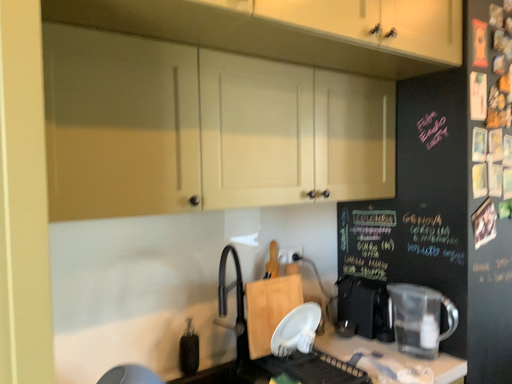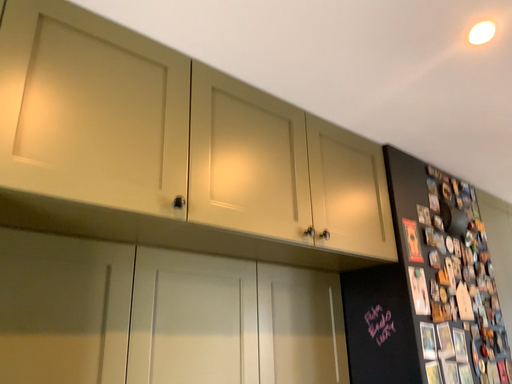
Question: Which way did the camera rotate in the video?

Choices:
 (A) rotated downward
 (B) rotated upward

Answer: (B)